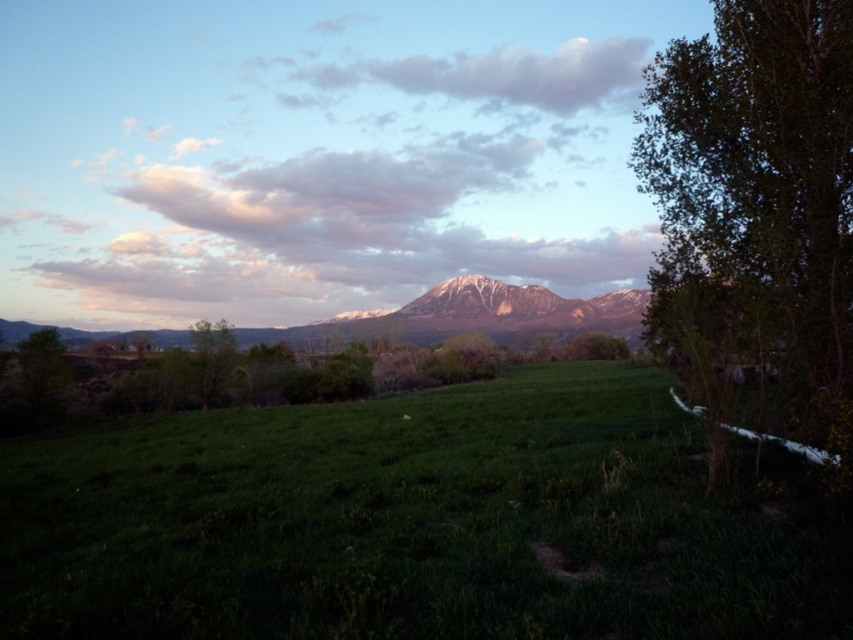
You are a hiker standing at the edge of the green grassy field at center and want to take a photo of the green leafy tree at right. Which object should you focus on first if you want both to be in sharp focus?

The green grassy field at center is closer to you than the green leafy tree at right, so you should focus on the green grassy field at center first to ensure both are in focus.